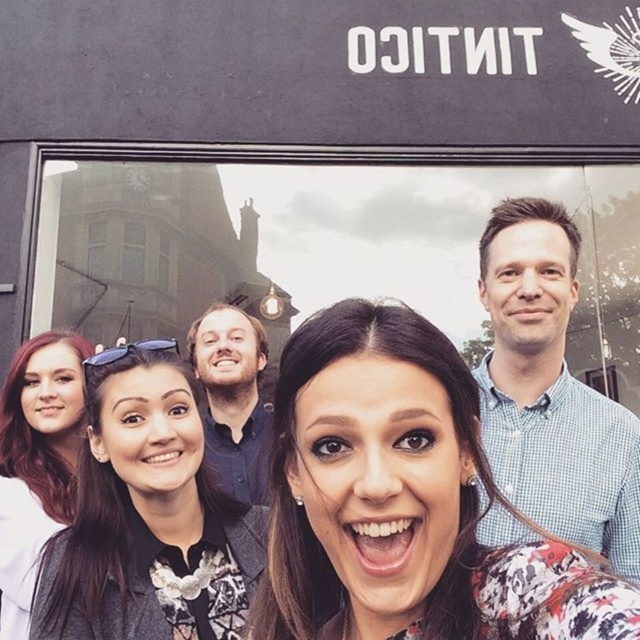
Based on the photo, you are a photographer trying to frame a shot of the group. The floral fabric dress at center and the matte black hair at left are both in your viewfinder. Based on their sizes, which object should you adjust your focus on to ensure both fit comfortably in the frame?

The floral fabric dress at center might be wider than matte black hair at left, so you should focus on adjusting the frame to accommodate the wider floral fabric dress at center to ensure both fit comfortably.

You are standing in front of the TINTICO building and see the group taking a selfie. There is a floral fabric dress at center. Can you determine if the dress is positioned closer to the building or farther away based on its coordinates?

The floral fabric dress at center is located at point (403, 500), which indicates its position relative to the image frame. However, without additional spatial context or depth information, it is impossible to determine if it is closer to the building or farther away solely based on coordinates.

You are taking a photo of the group and notice the floral fabric dress at center and the blue checkered shirt at upper right. Which clothing item is positioned lower in the image?

The floral fabric dress at center is below the blue checkered shirt at upper right, so it is positioned lower in the image.